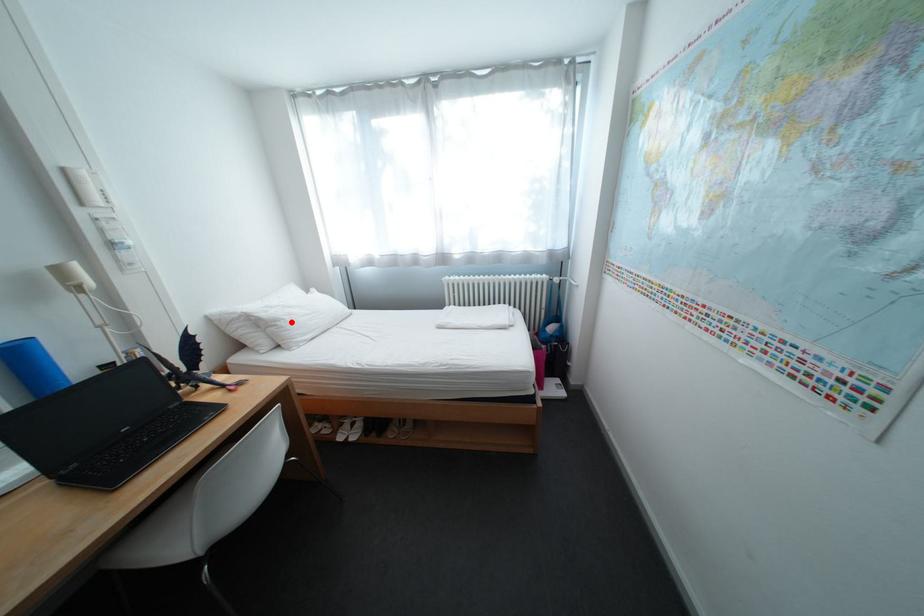
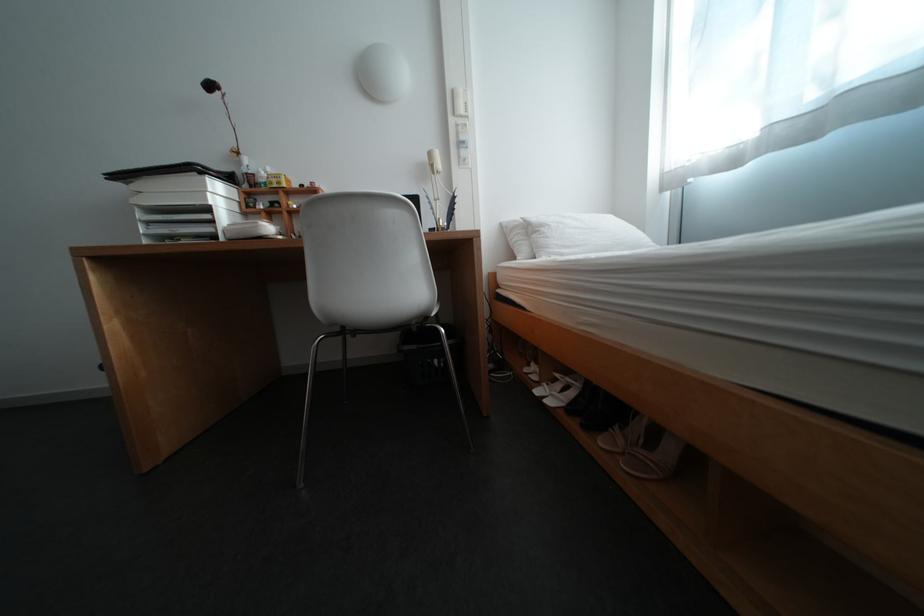
The point at the highlighted location is marked in the first image. Where is the corresponding point in the second image?

(555, 228)